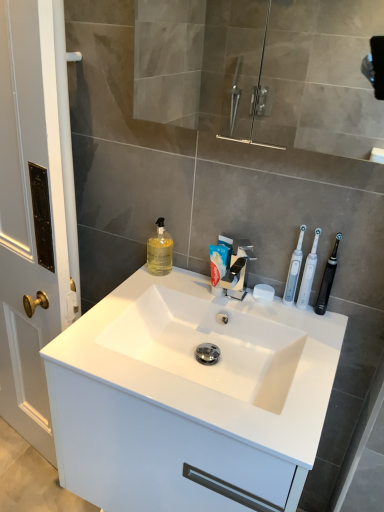
This screenshot has height=512, width=384. I want to click on vacant space that's between translucent yellow liquid at sink left and white plastic toothbrushes at right, which is the 1th toothbrush in left-to-right order, so click(x=204, y=284).